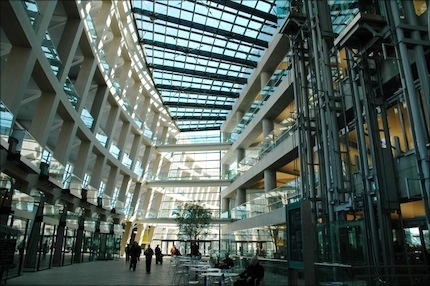
You are a GUI agent. You are given a task and a screenshot of the screen. Output one action in this format:
    pyautogui.click(x=<x>, y=<y>)
    Task: Click on the chair
    
    Given the screenshot: What is the action you would take?
    pyautogui.click(x=181, y=272)